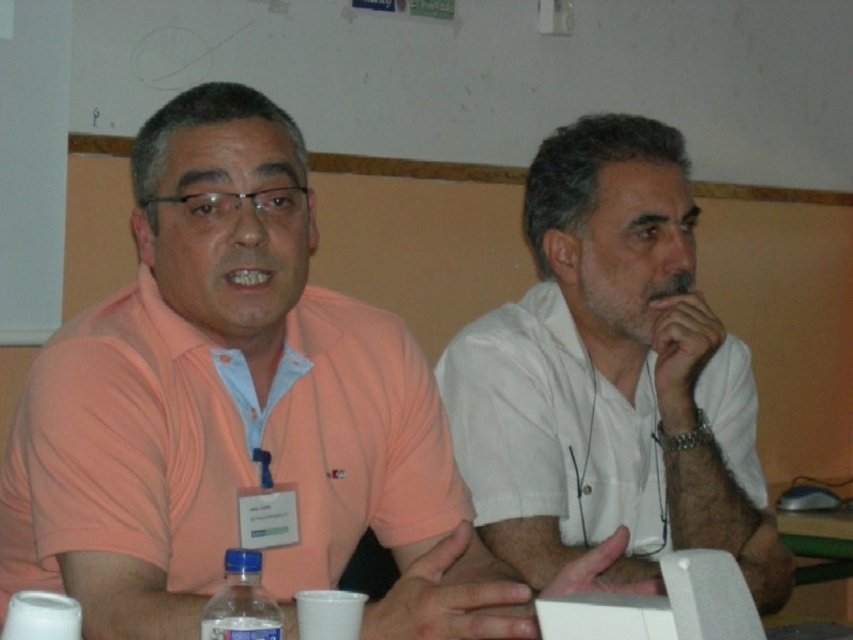
Between matte orange shirt at center and transparent plastic bottle at lower left, which one is positioned lower?

transparent plastic bottle at lower left is below.

Is matte orange shirt at center to the right of transparent plastic bottle at lower left from the viewer's perspective?

Yes, matte orange shirt at center is to the right of transparent plastic bottle at lower left.

Image resolution: width=853 pixels, height=640 pixels. Identify the location of matte orange shirt at center. (234, 408).

Identify the location of matte orange shirt at center. (234, 408).

Does green plastic table at lower right have a lesser width compared to transparent plastic bottle at lower left?

In fact, green plastic table at lower right might be wider than transparent plastic bottle at lower left.

Does point (834, 616) lie in front of point (234, 582)?

No, it is behind (234, 582).

Does point (793, 593) lie behind point (277, 625)?

Yes, it is.

At what (x,y) coordinates should I click in order to perform the action: click on green plastic table at lower right. Please return your answer as a coordinate pair (x, y). Looking at the image, I should click on (819, 557).

Is point (579, 186) in front of point (247, 579)?

No, (579, 186) is further to viewer.

The width and height of the screenshot is (853, 640). What do you see at coordinates (610, 376) in the screenshot?
I see `white matte shirt at center` at bounding box center [610, 376].

Find the location of a particular element. Image resolution: width=853 pixels, height=640 pixels. white matte shirt at center is located at coordinates (610, 376).